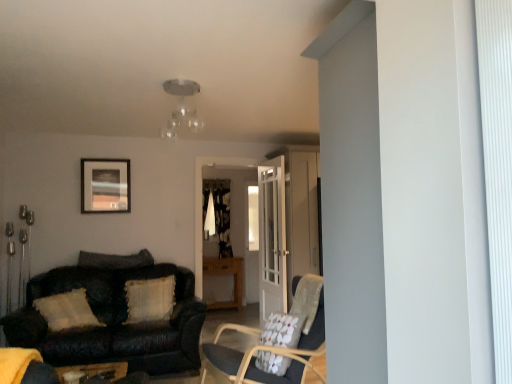
Question: From a real-world perspective, is leather couch at left positioned under clear glass light fixture at upper center based on gravity?

Choices:
 (A) yes
 (B) no

Answer: (A)

Question: From the image's perspective, is leather couch at left located above clear glass light fixture at upper center?

Choices:
 (A) no
 (B) yes

Answer: (A)

Question: From a real-world perspective, does leather couch at left stand above clear glass light fixture at upper center?

Choices:
 (A) yes
 (B) no

Answer: (B)

Question: Considering the relative sizes of leather couch at left and clear glass light fixture at upper center in the image provided, is leather couch at left bigger than clear glass light fixture at upper center?

Choices:
 (A) no
 (B) yes

Answer: (B)

Question: Is leather couch at left directly adjacent to clear glass light fixture at upper center?

Choices:
 (A) no
 (B) yes

Answer: (A)

Question: Is the position of leather couch at left more distant than that of clear glass light fixture at upper center?

Choices:
 (A) yes
 (B) no

Answer: (A)

Question: Is textured beige pillow at center left, which is counted as the 2th pillow, starting from the right, not within clear glass light fixture at upper center?

Choices:
 (A) yes
 (B) no

Answer: (A)

Question: Is textured beige pillow at center left, which is the 2th pillow from left to right, shorter than clear glass light fixture at upper center?

Choices:
 (A) yes
 (B) no

Answer: (B)

Question: Is textured beige pillow at center left, which ranks as the 2th pillow in back-to-front order, bigger than clear glass light fixture at upper center?

Choices:
 (A) yes
 (B) no

Answer: (A)

Question: Is textured beige pillow at center left, which is the 2th pillow from left to right, at the left side of clear glass light fixture at upper center?

Choices:
 (A) yes
 (B) no

Answer: (A)

Question: Would you say textured beige pillow at center left, which is the 2th pillow from left to right, contains clear glass light fixture at upper center?

Choices:
 (A) no
 (B) yes

Answer: (A)

Question: Is textured beige pillow at center left, which is counted as the 2th pillow, starting from the right, wider than clear glass light fixture at upper center?

Choices:
 (A) yes
 (B) no

Answer: (B)

Question: Considering the relative sizes of floral fabric chair at center and textured beige pillow at center left, which is counted as the 2th pillow, starting from the right, in the image provided, is floral fabric chair at center shorter than textured beige pillow at center left, which is counted as the 2th pillow, starting from the right,?

Choices:
 (A) no
 (B) yes

Answer: (A)